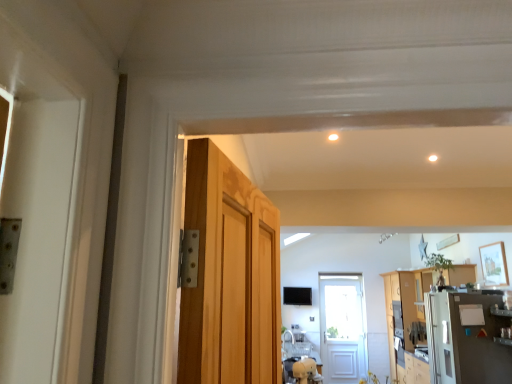
I want to click on vacant space to the right of white glossy light at upper center, so click(x=362, y=138).